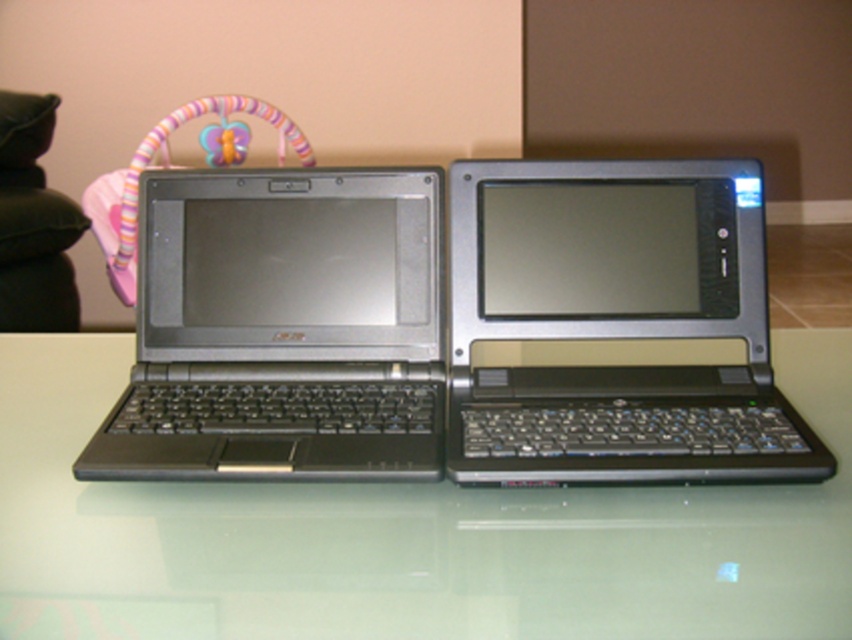
Question: Which is nearer to the velvety pink pillow at left?

Choices:
 (A) black matte laptop at left
 (B) satin black laptop at center

Answer: (A)

Question: Does black matte laptop at left have a smaller size compared to velvety pink pillow at left?

Choices:
 (A) yes
 (B) no

Answer: (A)

Question: Based on their relative distances, which object is farther from the velvety pink pillow at left?

Choices:
 (A) white glossy table at center
 (B) satin black laptop at center

Answer: (B)

Question: Which point is farther to the camera?

Choices:
 (A) (4, 211)
 (B) (381, 308)
 (C) (792, 552)
 (D) (686, 250)

Answer: (A)

Question: Can you confirm if white glossy table at center is positioned below black matte laptop at left?

Choices:
 (A) no
 (B) yes

Answer: (B)

Question: Does white glossy table at center come in front of satin black laptop at center?

Choices:
 (A) yes
 (B) no

Answer: (A)